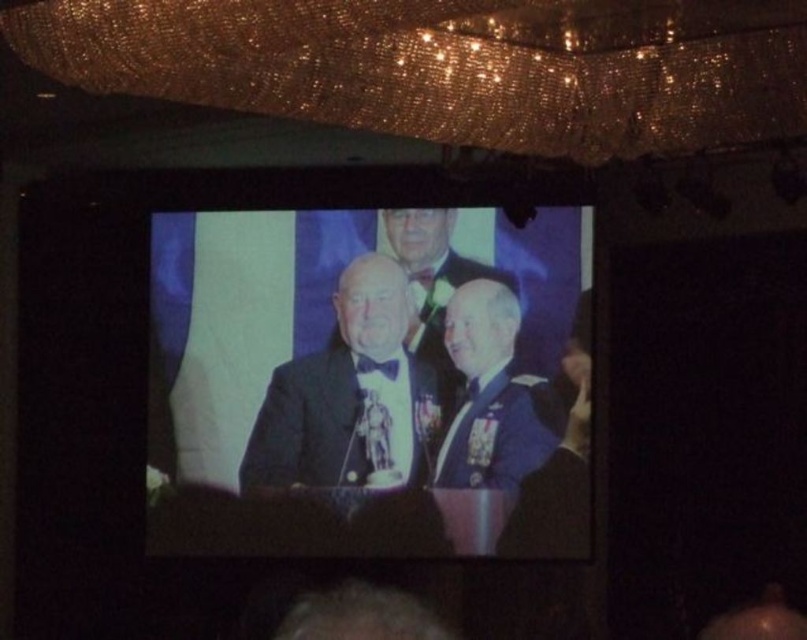
Question: Which object is positioned farthest from the black satin suit at center?

Choices:
 (A) shiny blue suit at center
 (B) satin black suit at center
 (C) uniformed military officer at center

Answer: (A)

Question: Which point is farther to the camera?

Choices:
 (A) (483, 292)
 (B) (563, 531)
 (C) (429, 397)

Answer: (C)

Question: Which of the following is the closest to the observer?

Choices:
 (A) (350, 294)
 (B) (396, 365)
 (C) (438, 262)

Answer: (B)

Question: Is black satin suit at center smaller than satin black suit at center?

Choices:
 (A) yes
 (B) no

Answer: (B)

Question: Is uniformed military officer at center closer to the viewer compared to shiny blue suit at center?

Choices:
 (A) no
 (B) yes

Answer: (B)

Question: Observing the image, what is the correct spatial positioning of uniformed military officer at center in reference to shiny blue suit at center?

Choices:
 (A) right
 (B) left

Answer: (A)